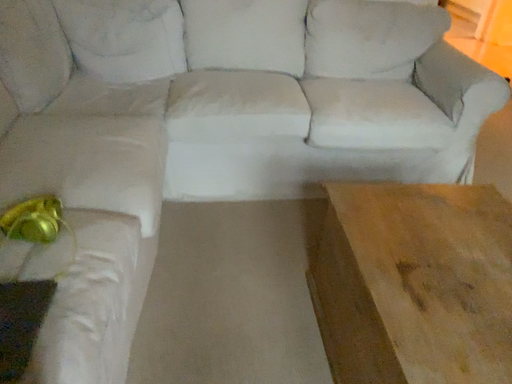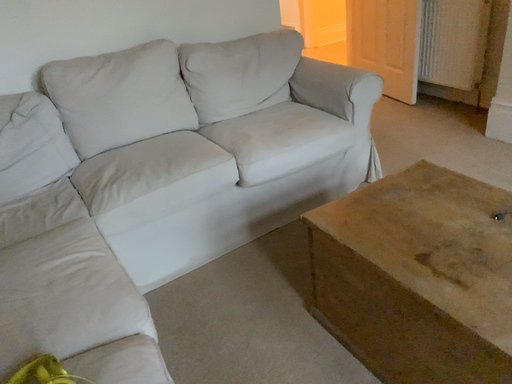
Question: How did the camera likely rotate when shooting the video?

Choices:
 (A) rotated upward
 (B) rotated downward

Answer: (A)